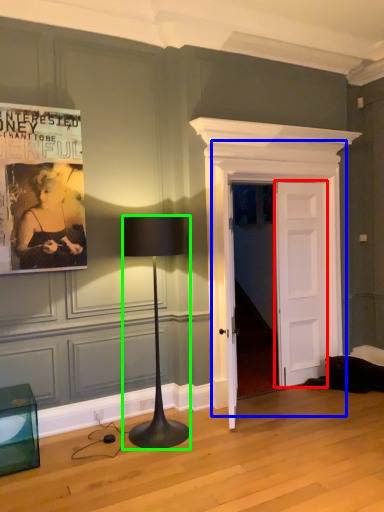
Question: Which object is the closest to the door (highlighted by a red box)? Choose among these: door (highlighted by a blue box) or lamp (highlighted by a green box).

Choices:
 (A) door
 (B) lamp

Answer: (A)